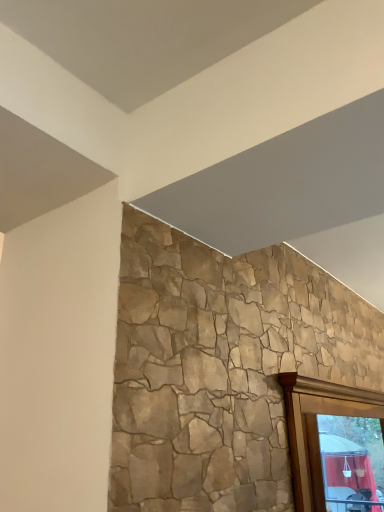
Measure the distance between brown wooden frame at right and camera.

The distance of brown wooden frame at right from camera is 1.23 meters.

This screenshot has height=512, width=384. Describe the element at coordinates (317, 428) in the screenshot. I see `brown wooden frame at right` at that location.

Where is `brown wooden frame at right`? The height and width of the screenshot is (512, 384). brown wooden frame at right is located at coordinates (317, 428).

Identify the location of brown wooden frame at right. (317, 428).